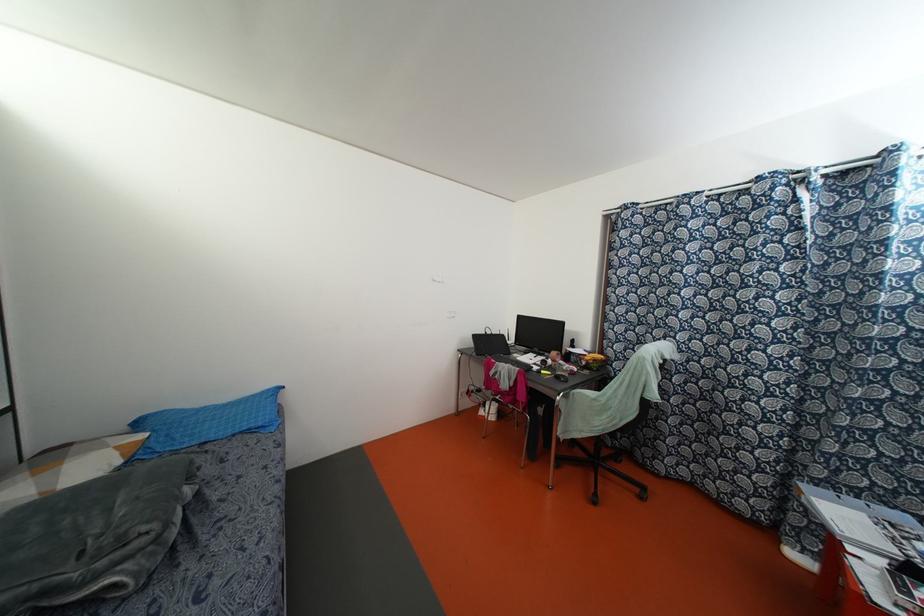
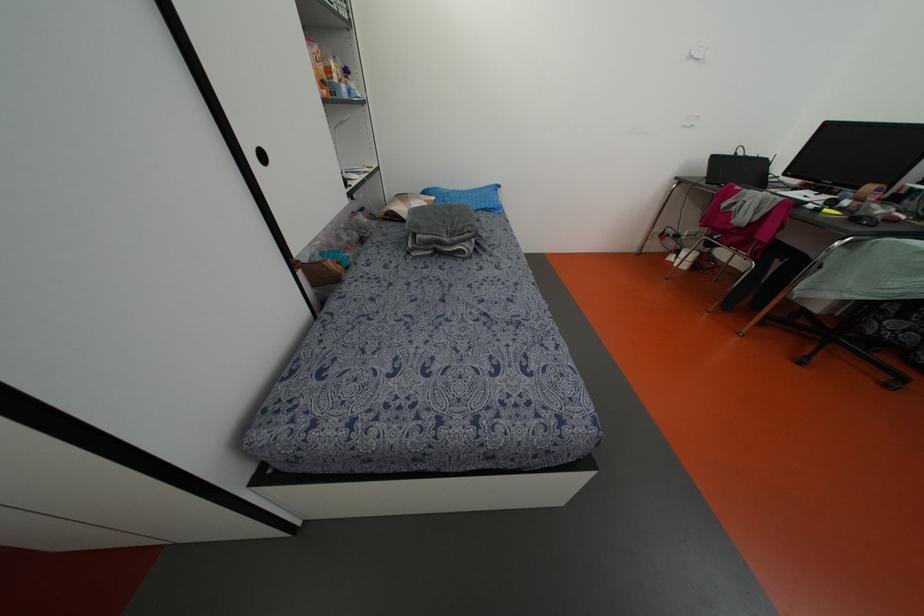
Where in the second image is the point corresponding to pixel 52 454 from the first image?

(402, 197)